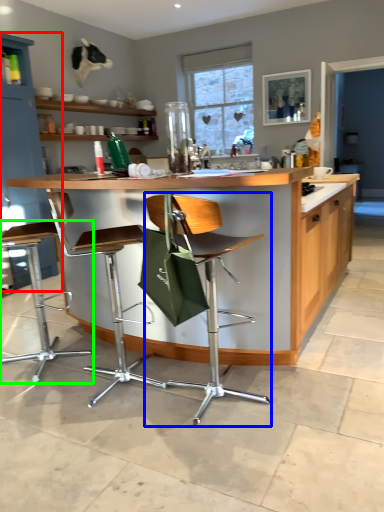
Question: Which object is the closest to the cabinetry (highlighted by a red box)? Choose among these: chair (highlighted by a blue box) or chair (highlighted by a green box).

Choices:
 (A) chair
 (B) chair

Answer: (B)